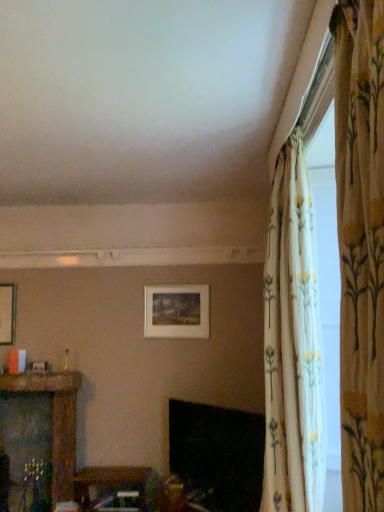
Question: Can you confirm if matte white picture frame at center is taller than wooden table at lower center, positioned as the first furniture in right-to-left order?

Choices:
 (A) no
 (B) yes

Answer: (B)

Question: Does matte white picture frame at center have a smaller size compared to wooden table at lower center, the 2th furniture positioned from the left?

Choices:
 (A) yes
 (B) no

Answer: (A)

Question: From the image's perspective, is matte white picture frame at center on wooden table at lower center, the 2th furniture positioned from the left?

Choices:
 (A) yes
 (B) no

Answer: (A)

Question: Is matte white picture frame at center outside wooden table at lower center, the 2th furniture positioned from the left?

Choices:
 (A) no
 (B) yes

Answer: (B)

Question: Considering the relative positions of matte white picture frame at center and wooden table at lower center, positioned as the first furniture in right-to-left order, in the image provided, is matte white picture frame at center to the left of wooden table at lower center, positioned as the first furniture in right-to-left order, from the viewer's perspective?

Choices:
 (A) yes
 (B) no

Answer: (B)

Question: Is matte white picture frame at center wider than wooden table at lower center, the 2th furniture positioned from the left?

Choices:
 (A) yes
 (B) no

Answer: (B)

Question: Considering the relative sizes of black glossy fireplace at lower center and wooden carved shelf at left, arranged as the 2th furniture when viewed from the right, in the image provided, is black glossy fireplace at lower center bigger than wooden carved shelf at left, arranged as the 2th furniture when viewed from the right,?

Choices:
 (A) yes
 (B) no

Answer: (B)

Question: Considering the relative positions of black glossy fireplace at lower center and wooden carved shelf at left, the 1th furniture from the left, in the image provided, is black glossy fireplace at lower center to the left of wooden carved shelf at left, the 1th furniture from the left, from the viewer's perspective?

Choices:
 (A) yes
 (B) no

Answer: (B)

Question: Is black glossy fireplace at lower center outside of wooden carved shelf at left, arranged as the 2th furniture when viewed from the right?

Choices:
 (A) no
 (B) yes

Answer: (B)

Question: From a real-world perspective, is black glossy fireplace at lower center beneath wooden carved shelf at left, the 1th furniture from the left?

Choices:
 (A) yes
 (B) no

Answer: (B)

Question: Is black glossy fireplace at lower center closer to camera compared to wooden carved shelf at left, arranged as the 2th furniture when viewed from the right?

Choices:
 (A) no
 (B) yes

Answer: (B)

Question: Considering the relative sizes of black glossy fireplace at lower center and wooden carved shelf at left, the 1th furniture from the left, in the image provided, is black glossy fireplace at lower center smaller than wooden carved shelf at left, the 1th furniture from the left,?

Choices:
 (A) yes
 (B) no

Answer: (A)

Question: From a real-world perspective, is floral fabric curtain at upper right, the 2th curtain viewed from the front, below wooden table at lower center, the 2th furniture positioned from the left?

Choices:
 (A) yes
 (B) no

Answer: (B)